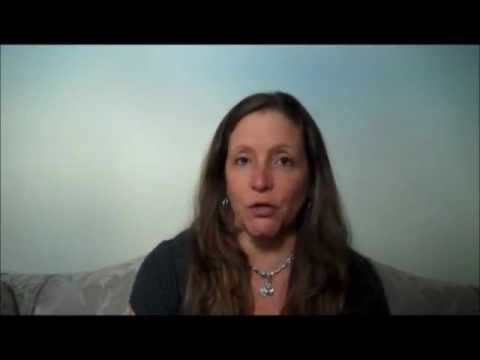
The image size is (480, 360). Identify the location of pendant. coord(262,291).